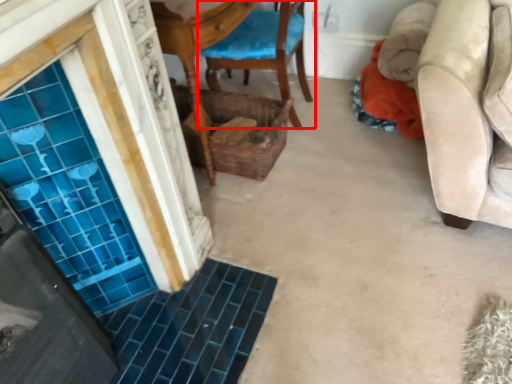
Question: Observing the image, what is the correct spatial positioning of chair (annotated by the red box) in reference to basket?

Choices:
 (A) left
 (B) right

Answer: (B)